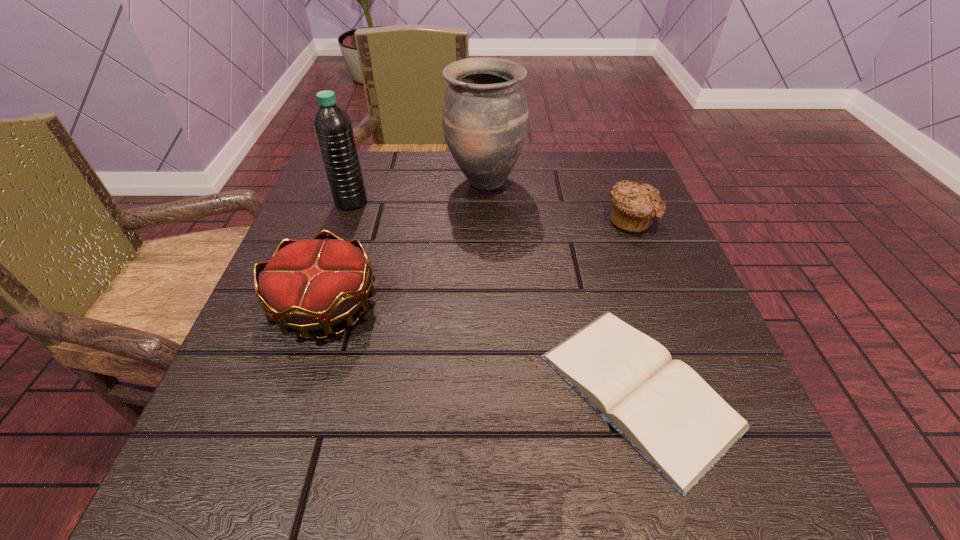
At what (x,y) coordinates should I click in order to perform the action: click on vacant space that is in between the crown and the second shortest object. Please return your answer as a coordinate pair (x, y). Looking at the image, I should click on (478, 263).

Where is `empty space between the crown and the second shortest object`? This screenshot has width=960, height=540. empty space between the crown and the second shortest object is located at coordinates (478, 263).

In order to click on free area in between the water bottle and the urn in this screenshot , I will do `click(418, 192)`.

At what (x,y) coordinates should I click in order to perform the action: click on unoccupied position between the water bottle and the urn. Please return your answer as a coordinate pair (x, y). Looking at the image, I should click on (418, 192).

At what (x,y) coordinates should I click in order to perform the action: click on free space that is in between the crown and the shortest object. Please return your answer as a coordinate pair (x, y). Looking at the image, I should click on (482, 348).

Image resolution: width=960 pixels, height=540 pixels. In order to click on object that ranks as the third closest to the urn in this screenshot , I will do `click(312, 284)`.

Select which object is the closest to the urn. Please provide its 2D coordinates. Your answer should be formatted as a tuple, i.e. [(x, y)], where the tuple contains the x and y coordinates of a point satisfying the conditions above.

[(634, 206)]

The height and width of the screenshot is (540, 960). I want to click on free spot that satisfies the following two spatial constraints: 1. on the front side of the crown; 2. on the right side of the shortest object, so click(298, 389).

This screenshot has width=960, height=540. I want to click on vacant area that satisfies the following two spatial constraints: 1. on the front side of the water bottle; 2. on the right side of the crown, so click(x=315, y=306).

This screenshot has height=540, width=960. I want to click on free location that satisfies the following two spatial constraints: 1. on the back side of the crown; 2. on the left side of the second shortest object, so click(354, 220).